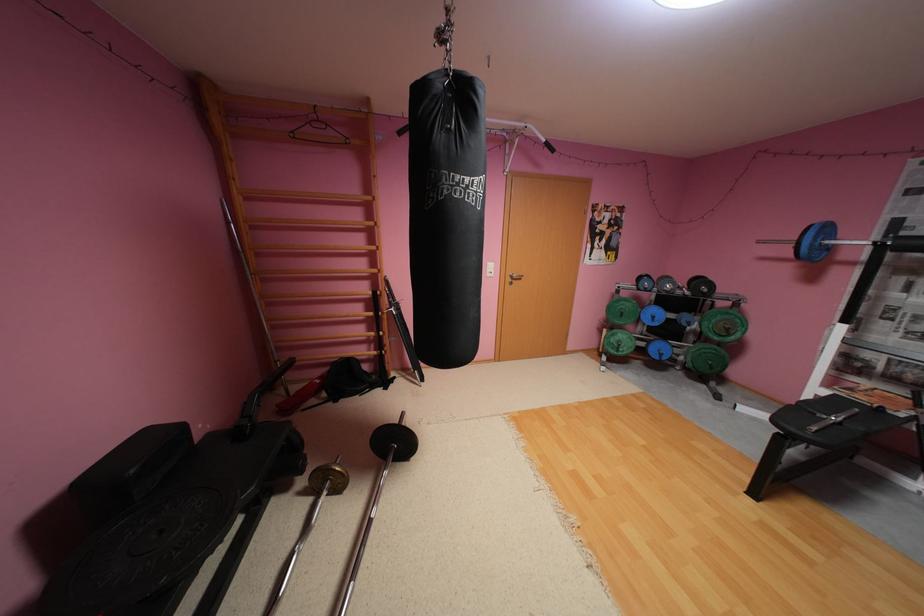
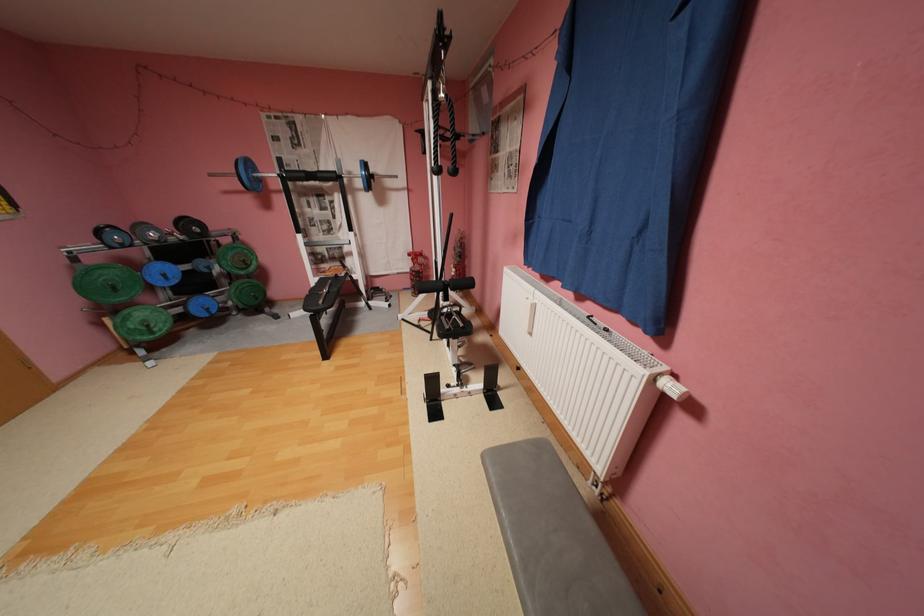
The first image is from the beginning of the video and the second image is from the end. How did the camera likely rotate when shooting the video?

The camera rotated toward right-down.